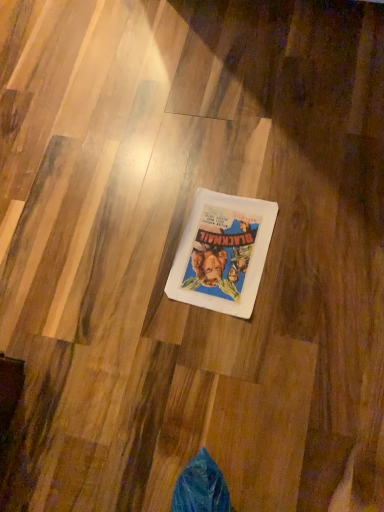
You are a GUI agent. You are given a task and a screenshot of the screen. Output one action in this format:
    pyautogui.click(x=<x>, y=<y>)
    Task: Click on the free space above white matte book cover at center (from a real-world perspective)
    The height and width of the screenshot is (512, 384).
    Given the screenshot: What is the action you would take?
    pyautogui.click(x=218, y=243)